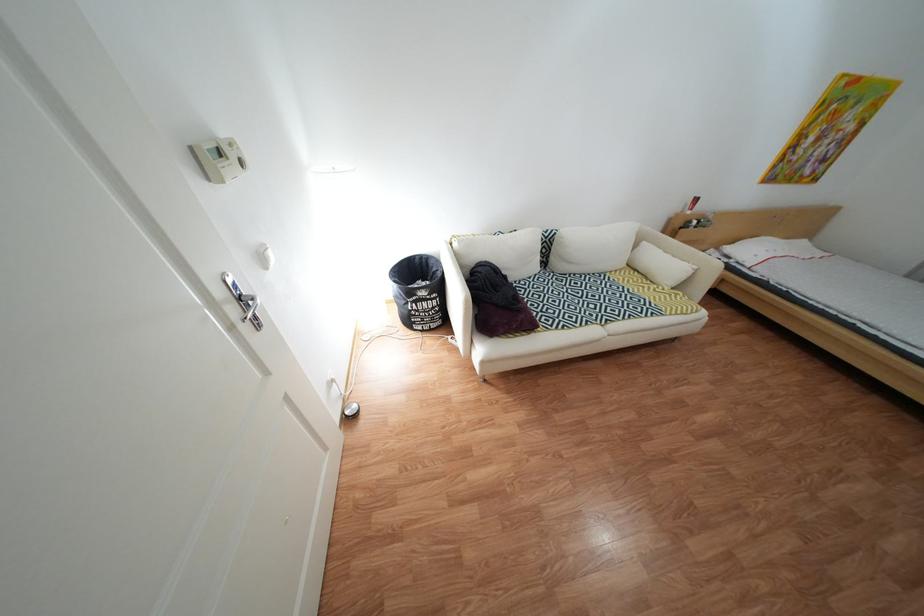
What do you see at coordinates (220, 160) in the screenshot?
I see `the white thermostat` at bounding box center [220, 160].